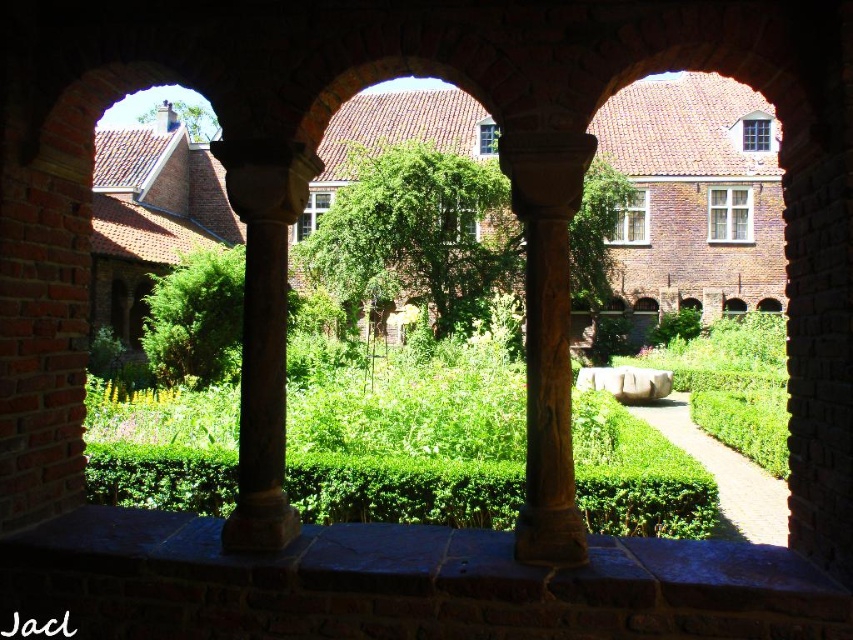
Question: Where is green leafy hedge at center located in relation to green leafy tree at upper left in the image?

Choices:
 (A) below
 (B) above

Answer: (A)

Question: Which object is farther from the camera taking this photo?

Choices:
 (A) green leafy tree at upper left
 (B) green leafy hedge at center
 (C) green leafy tree at center

Answer: (A)

Question: Which point is farther to the camera?

Choices:
 (A) green leafy tree at upper left
 (B) green leafy hedge at center
 (C) brown carved column at center

Answer: (A)

Question: Which object appears farthest from the camera in this image?

Choices:
 (A) green leafy tree at center
 (B) green leafy tree at upper left
 (C) green leafy hedge at center

Answer: (B)

Question: Does green leafy hedge at center have a smaller size compared to brown carved column at center?

Choices:
 (A) yes
 (B) no

Answer: (B)

Question: Can you confirm if green leafy hedge at center is positioned to the right of green leafy tree at upper left?

Choices:
 (A) no
 (B) yes

Answer: (B)